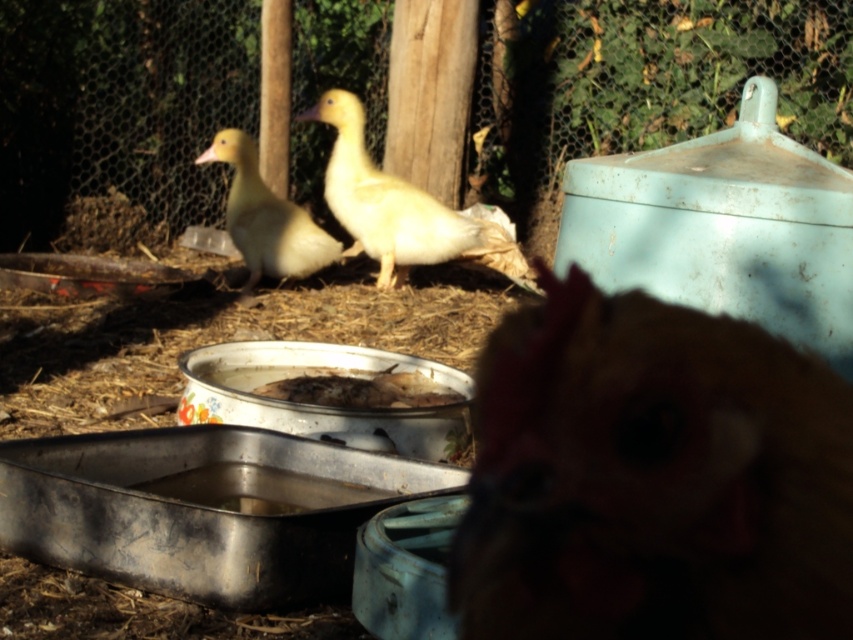
Is point (338, 195) farther from viewer compared to point (296, 248)?

That is True.

Who is lower down, white matte duck at center or yellow downy duckling at center?

yellow downy duckling at center is below.

Where is `white matte duck at center`? Image resolution: width=853 pixels, height=640 pixels. white matte duck at center is located at coordinates (403, 208).

Where is `white matte duck at center`? This screenshot has width=853, height=640. white matte duck at center is located at coordinates (403, 208).

Between brown feathered chicken at center and yellow downy duckling at center, which one is positioned lower?

brown feathered chicken at center

Between point (773, 364) and point (236, 188), which one is positioned in front?

Point (773, 364)

Who is more forward, (838, 579) or (293, 221)?

Point (838, 579) is in front.

Identify the location of brown feathered chicken at center. The width and height of the screenshot is (853, 640). (653, 477).

Can you confirm if brown feathered chicken at center is positioned to the left of white matte duck at center?

No, brown feathered chicken at center is not to the left of white matte duck at center.

The image size is (853, 640). I want to click on brown feathered chicken at center, so click(653, 477).